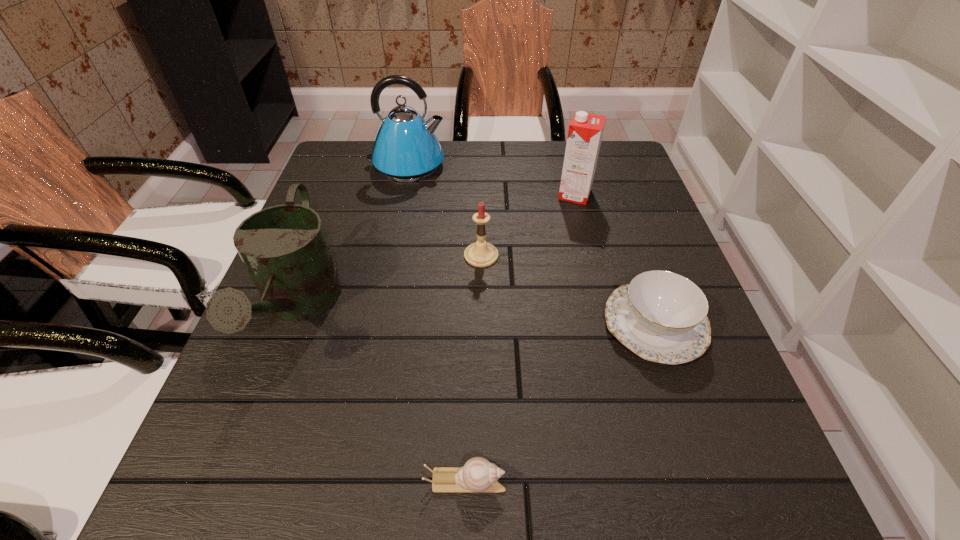
Locate an element on the screen. The image size is (960, 540). free space located on the left of the candle is located at coordinates [x=442, y=255].

Image resolution: width=960 pixels, height=540 pixels. Find the location of `free space located 0.400m on the handle side of the fifth tallest object`. free space located 0.400m on the handle side of the fifth tallest object is located at coordinates (392, 325).

Where is `free space located 0.060m on the handle side of the fifth tallest object`? free space located 0.060m on the handle side of the fifth tallest object is located at coordinates (572, 325).

Identify the location of vacant space situated 0.060m on the handle side of the fifth tallest object. (572, 325).

You are a GUI agent. You are given a task and a screenshot of the screen. Output one action in this format:
    pyautogui.click(x=<x>, y=<y>)
    Task: Click on the vacant region located 0.100m on the shell of the escargot
    This screenshot has height=540, width=960.
    Given the screenshot: What is the action you would take?
    pyautogui.click(x=575, y=482)

Where is `kettle that is at the far edge`? This screenshot has height=540, width=960. kettle that is at the far edge is located at coordinates (406, 149).

The width and height of the screenshot is (960, 540). In order to click on carton that is positioned at the far edge in this screenshot , I will do `click(585, 132)`.

The width and height of the screenshot is (960, 540). In order to click on object that is at the near edge in this screenshot , I will do `click(478, 475)`.

You are a GUI agent. You are given a task and a screenshot of the screen. Output one action in this format:
    pyautogui.click(x=<x>, y=<y>)
    Task: Click on the kettle that is at the left edge
    This screenshot has width=960, height=540.
    Given the screenshot: What is the action you would take?
    pyautogui.click(x=406, y=149)

The height and width of the screenshot is (540, 960). Identify the location of watering can that is at the left edge. (284, 248).